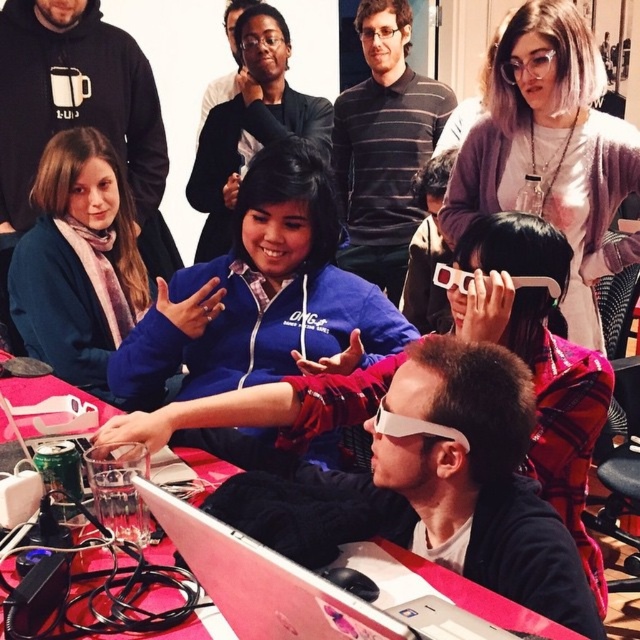
Is white plastic laptop at center to the left of matte blue hoodie at center from the viewer's perspective?

No, white plastic laptop at center is not to the left of matte blue hoodie at center.

Who is lower down, white plastic laptop at center or matte blue hoodie at center?

white plastic laptop at center

I want to click on white plastic laptop at center, so click(262, 580).

Consider the image. Between metallic silver laptop at center and white plastic laptop at center, which one is positioned higher?

white plastic laptop at center

Does point (202, 634) come farther from viewer compared to point (200, 568)?

Yes, point (202, 634) is farther from viewer.

Between point (556, 632) and point (195, 556), which one is positioned in front?

Positioned in front is point (195, 556).

Identify the location of metallic silver laptop at center. The image size is (640, 640). (260, 596).

Consider the image. Is matte blue hoodie at center-left above white plastic laptop at center?

Yes, matte blue hoodie at center-left is above white plastic laptop at center.

Who is shorter, matte blue hoodie at center-left or white plastic laptop at center?

white plastic laptop at center is shorter.

Locate an element on the screen. The height and width of the screenshot is (640, 640). matte blue hoodie at center-left is located at coordinates (77, 260).